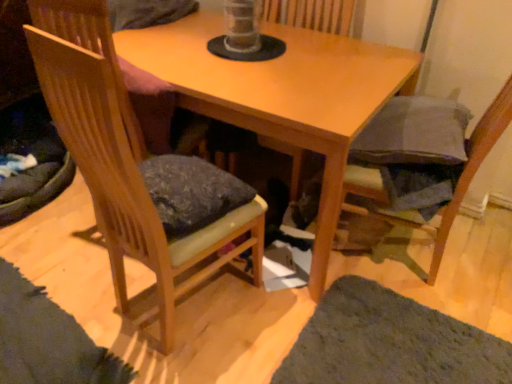
Identify the location of vacant space situated on the left part of wooden chair at left, which appears as the 2th chair when viewed from the right. The height and width of the screenshot is (384, 512). (97, 288).